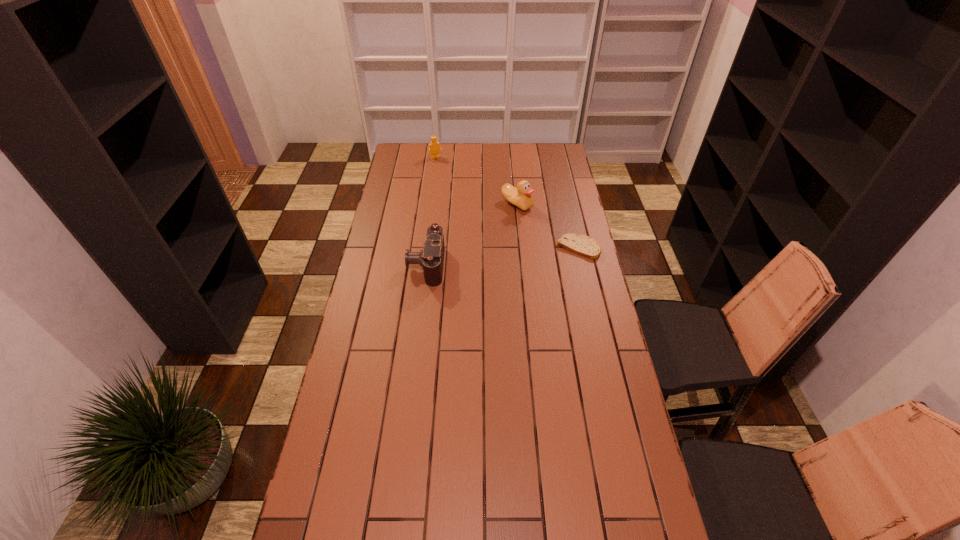
What are the coordinates of `vacant region between the camera and the pita bread` in the screenshot? It's located at (502, 256).

The height and width of the screenshot is (540, 960). I want to click on empty space that is in between the rightmost object and the camera, so click(x=502, y=256).

In order to click on the closest object relative to the third nearest object in this screenshot , I will do `click(583, 245)`.

Locate an element on the screen. This screenshot has height=540, width=960. the closest object to the third object from left to right is located at coordinates (583, 245).

Image resolution: width=960 pixels, height=540 pixels. Identify the location of vacant space that satisfies the following two spatial constraints: 1. on the front side of the farthest object; 2. on the front-facing side of the camera. (422, 265).

Where is `free point that satisfies the following two spatial constraints: 1. on the front side of the pita bread; 2. on the left side of the farthest object`? The width and height of the screenshot is (960, 540). free point that satisfies the following two spatial constraints: 1. on the front side of the pita bread; 2. on the left side of the farthest object is located at coordinates (424, 248).

Locate an element on the screen. The width and height of the screenshot is (960, 540). free space that satisfies the following two spatial constraints: 1. on the front side of the Lego; 2. on the front-facing side of the camera is located at coordinates (422, 265).

Find the location of a particular element. Image resolution: width=960 pixels, height=540 pixels. vacant position in the image that satisfies the following two spatial constraints: 1. on the front side of the camera; 2. on the front-facing side of the farthest object is located at coordinates (422, 265).